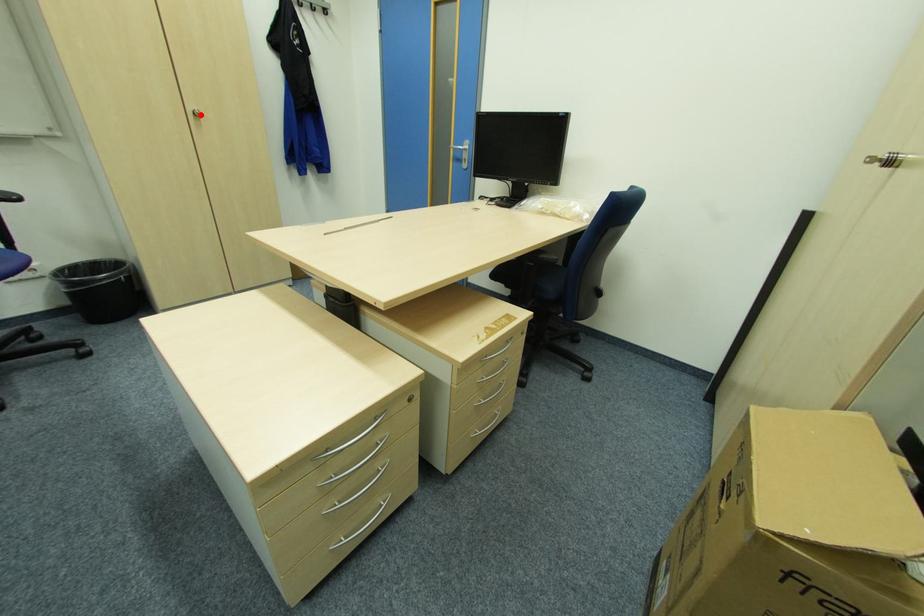
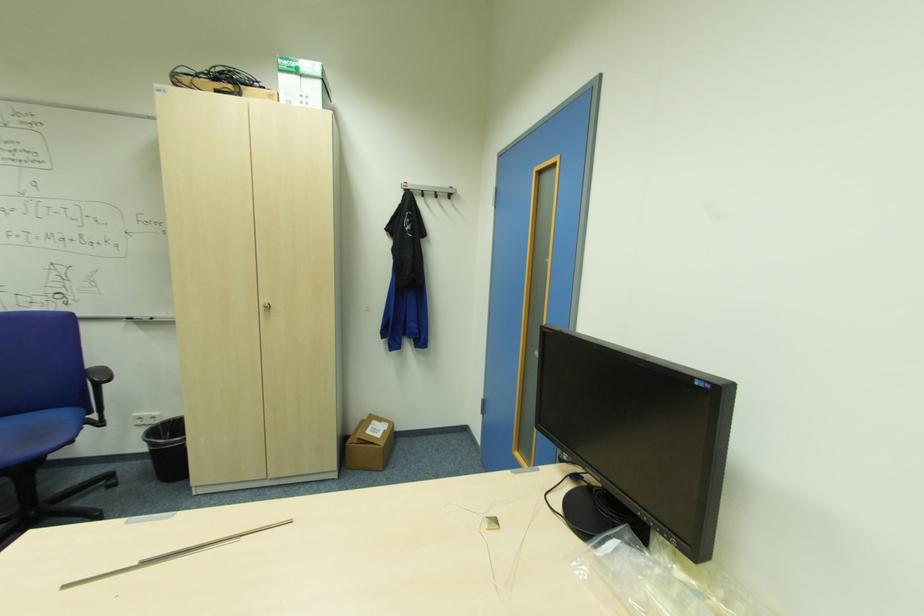
Find the pixel in the second image that matches the highlighted location in the first image.

(271, 307)